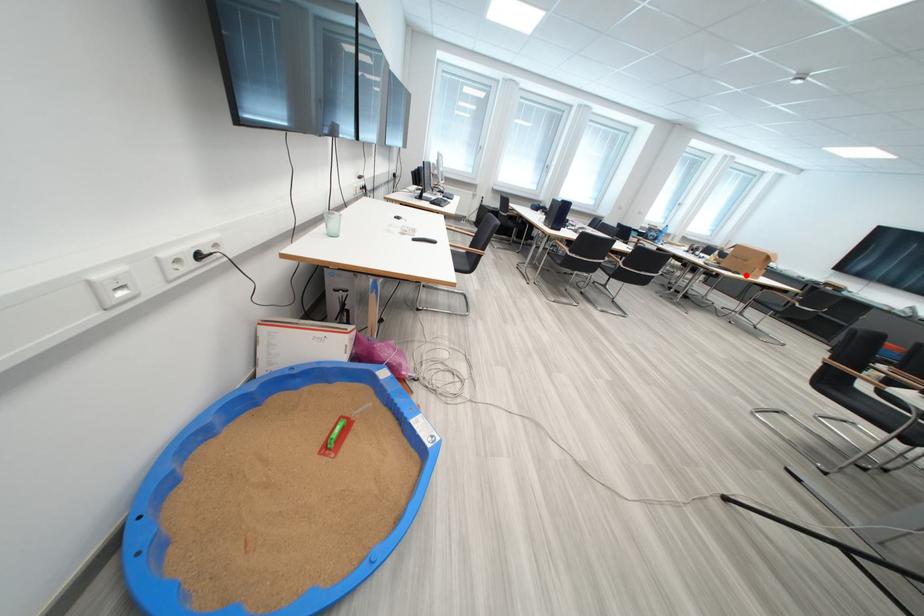
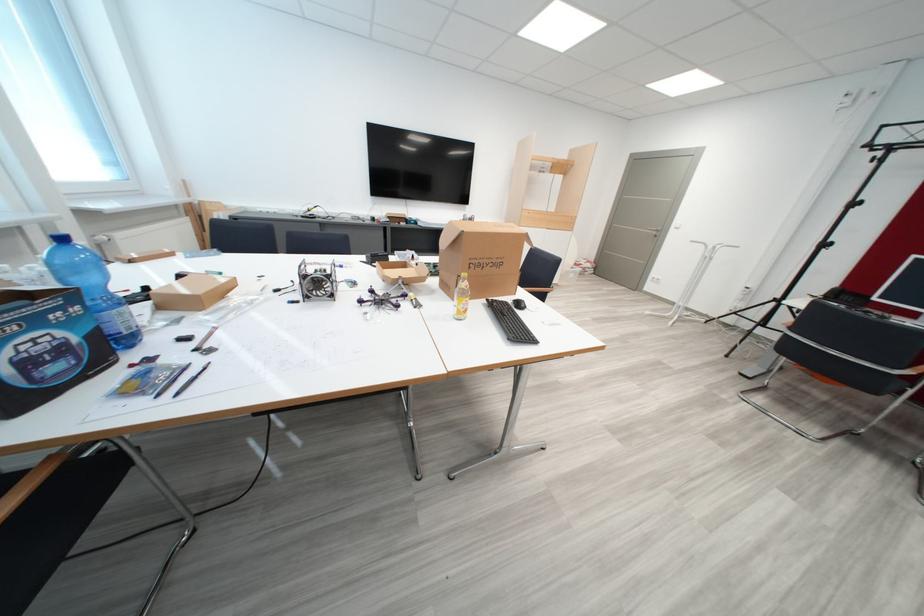
Question: I am providing you with two images of the same scene from different viewpoints. A red point is marked on the first image. Is the red point's position out of view in image 2?

Choices:
 (A) Yes
 (B) No

Answer: (A)